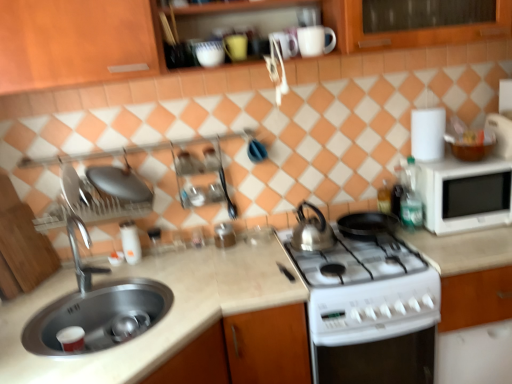
Find the location of `vacant space to the left of silver metallic tap at sink left`. vacant space to the left of silver metallic tap at sink left is located at coordinates (37, 308).